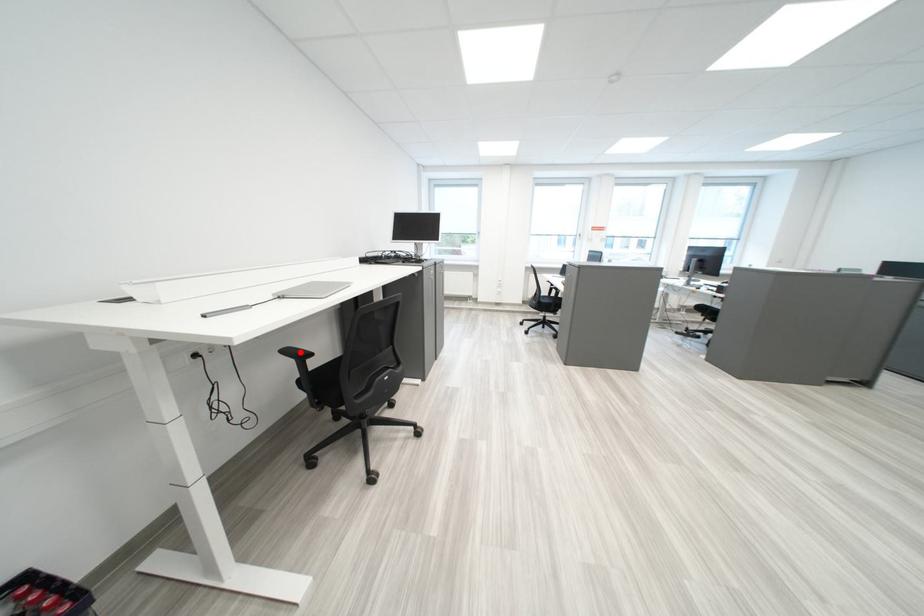
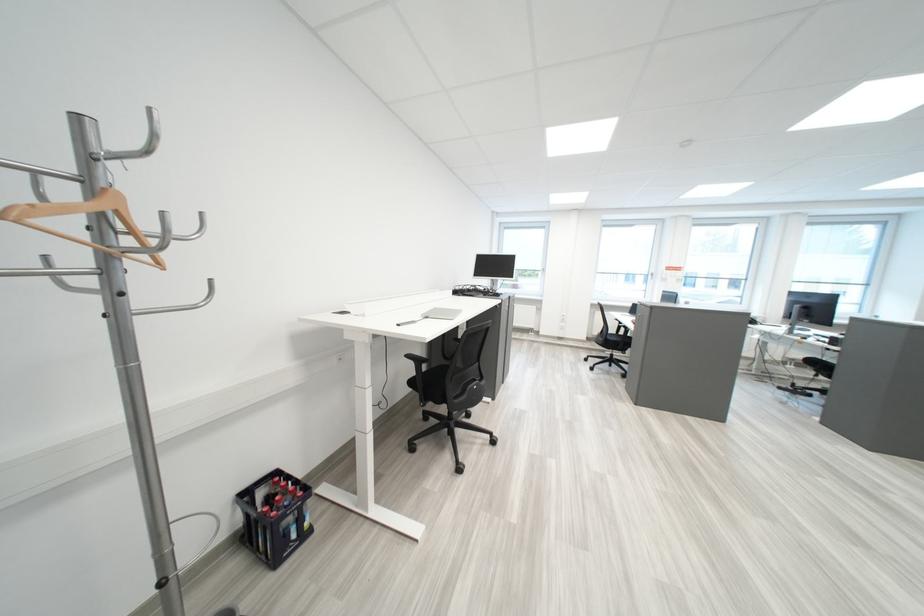
Locate, in the second image, the point that corresponds to the highlighted location in the first image.

(421, 358)